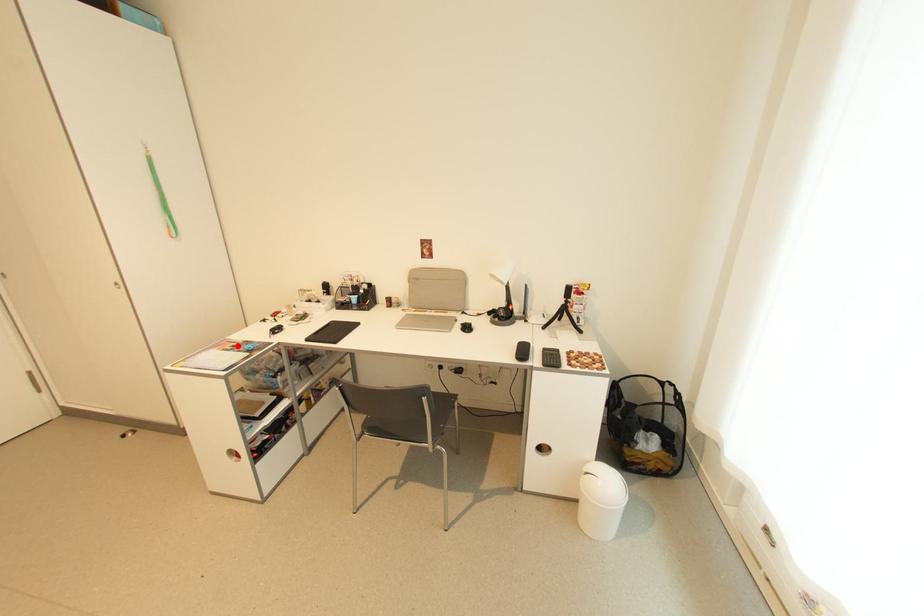
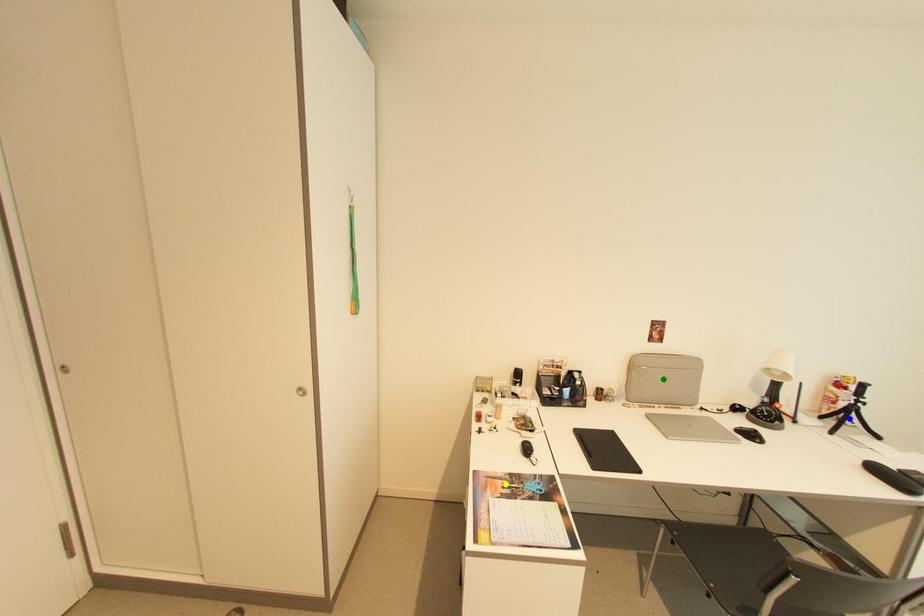
Question: I am providing you with two images of the same scene from different viewpoints. A red point is marked on the first image. You are given multiple points on the second image. Can you choose the point in image 2 that corresponds to the point in image 1?

Choices:
 (A) yellow point
 (B) green point
 (C) blue point

Answer: (A)